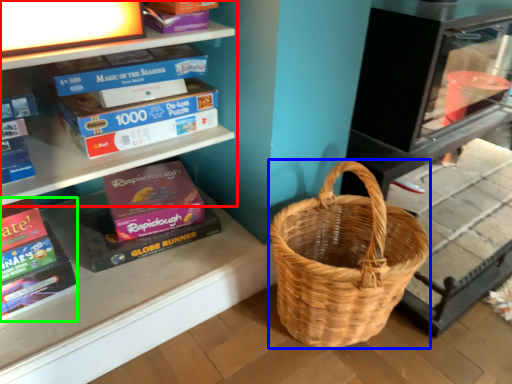
Question: Considering the real-world distances, which object is closest to shelf (highlighted by a red box)? picnic basket (highlighted by a blue box) or paperback book (highlighted by a green box).

Choices:
 (A) picnic basket
 (B) paperback book

Answer: (B)